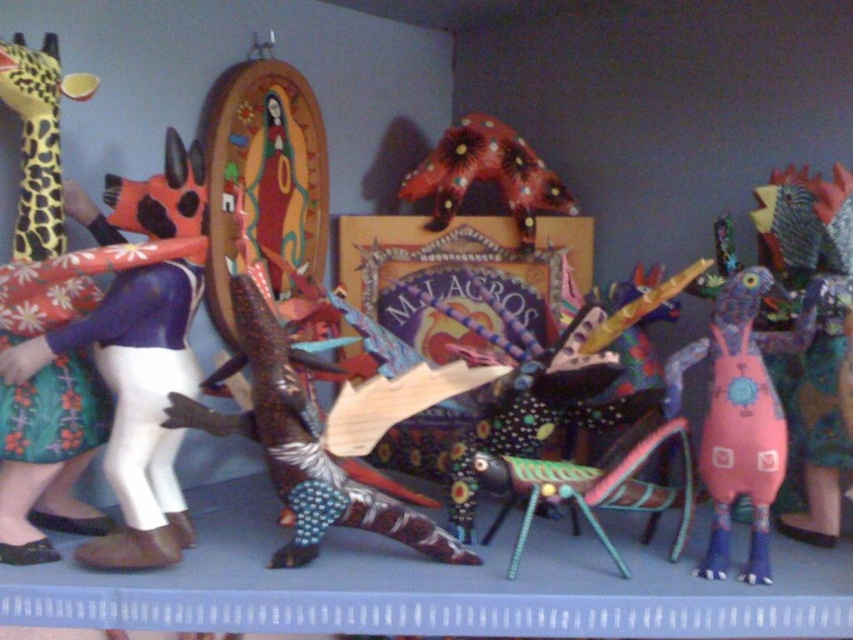
Consider the image. You are an art collector standing in front of the sculptures. You want to take a closer look at the matte purple fabric doll at left and the wooden lizard at center. Which sculpture can you reach first without moving your position?

The matte purple fabric doll at left is closer to the viewer than the wooden lizard at center, so you can reach the matte purple fabric doll at left first without moving your position.

You are standing in front of the sculptures and want to touch the closest object between the matte purple fabric doll at left and the matte yellow giraffe at left. Which one should you reach for?

The matte purple fabric doll at left is closer to you than the matte yellow giraffe at left, so you should reach for the matte purple fabric doll at left.